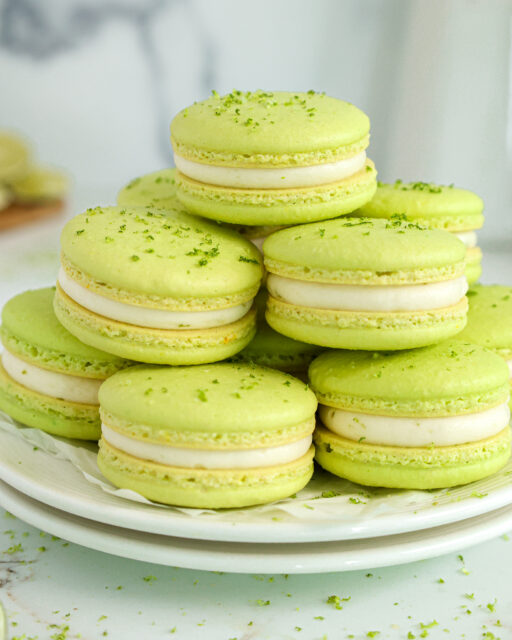
Find the location of a particular element. plates is located at coordinates (315, 563), (315, 541).